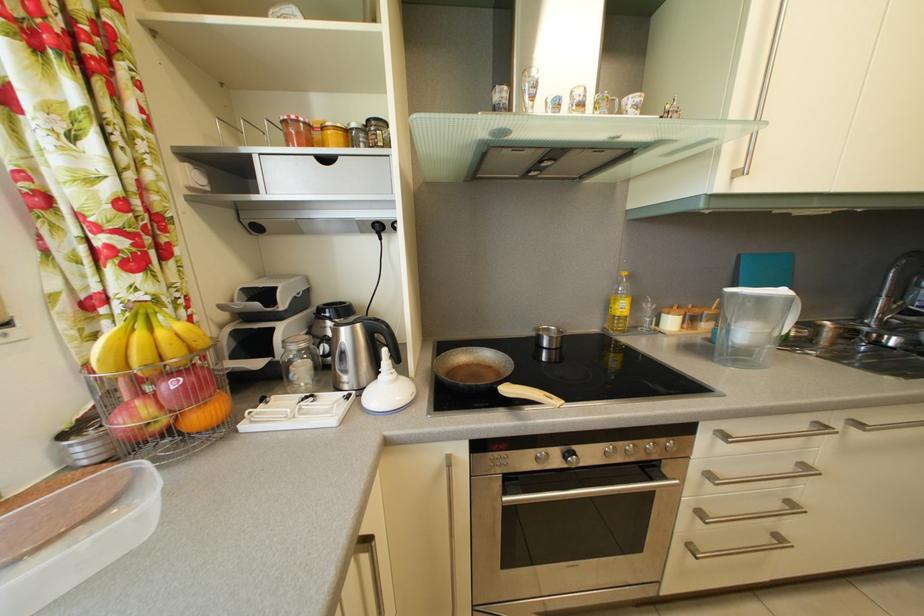
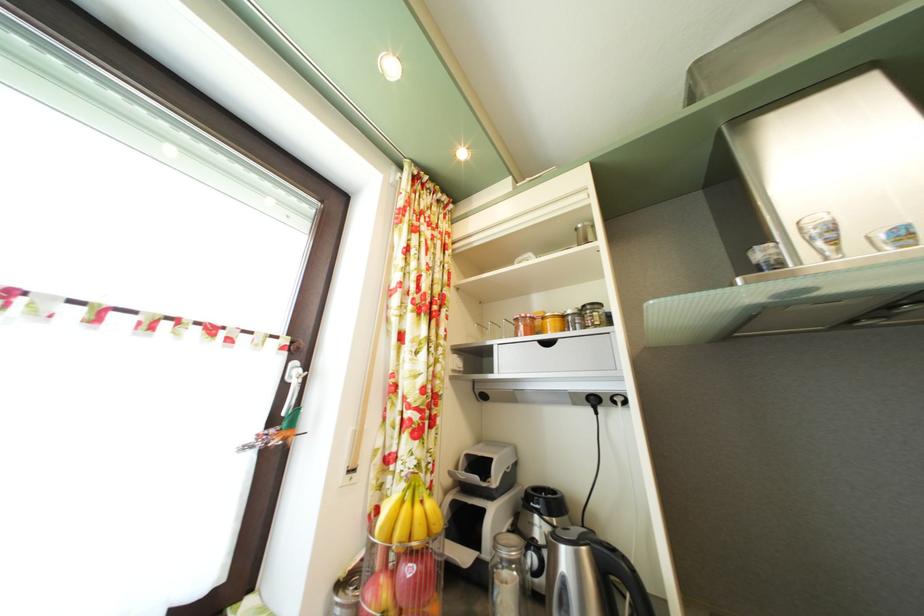
Find the pixel in the second image that matches (x=331, y=136) in the first image.

(552, 325)